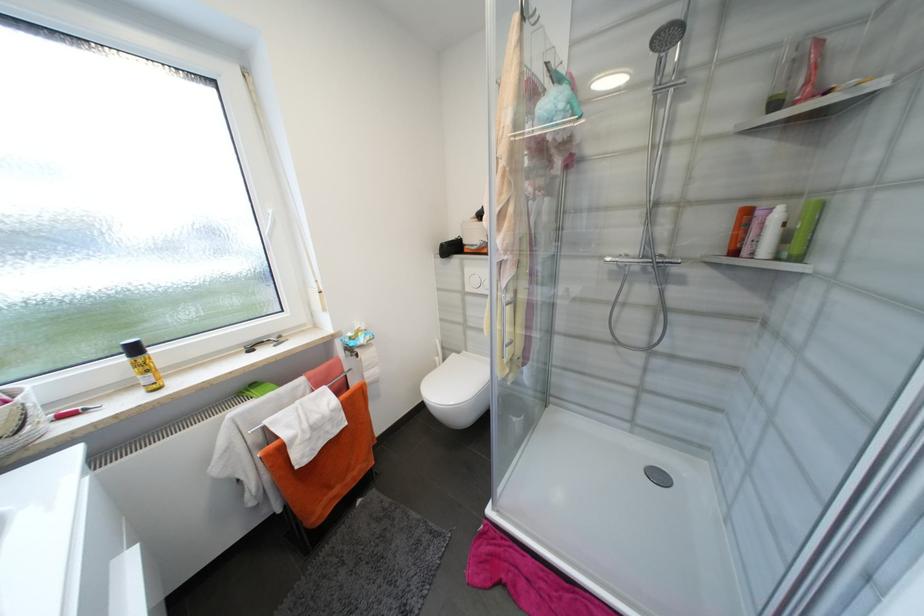
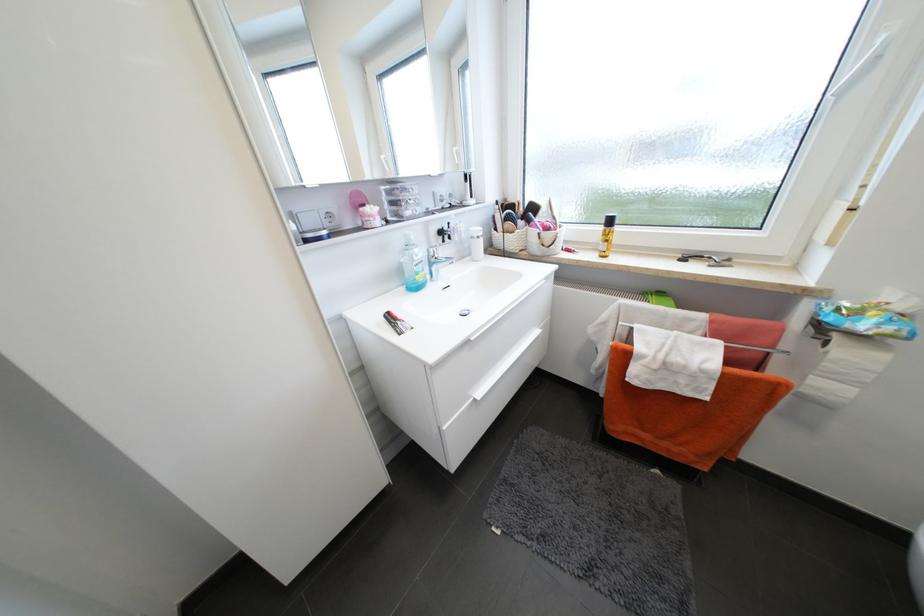
Looking at this image, first-person continuous shooting, in which direction is the camera rotating?

The camera's rotation is toward left-down.